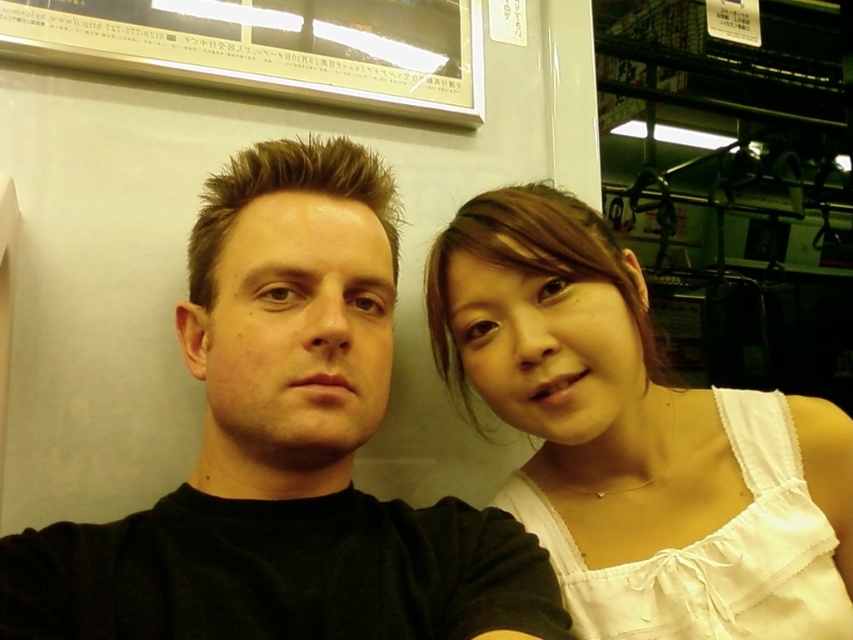
You are a tailor observing the black matte shirt at center and the white cotton tank top at right. Which clothing item is wider?

The black matte shirt at center is wider than the white cotton tank top at right.

You are an AI analyzing the positioning of clothing items in the scene. What are the exact coordinates of the black matte shirt at center?

The black matte shirt at center is located at coordinates point (286, 449).

You are a fashion designer observing two people in a public space. You notice the black matte shirt at center and the white cotton tank top at right. Which clothing item is shorter in height?

The black matte shirt at center has a lesser height compared to the white cotton tank top at right, so the black matte shirt at center is shorter in height.